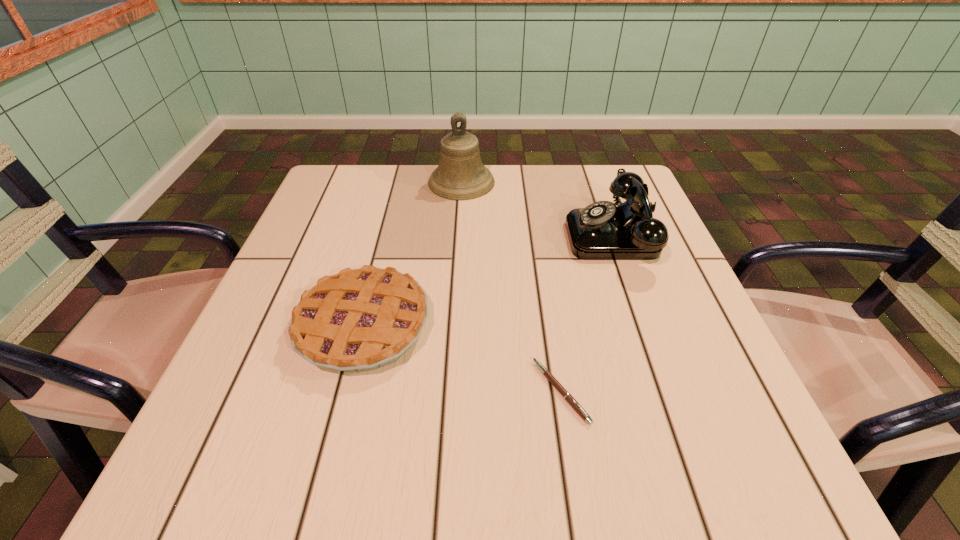
The height and width of the screenshot is (540, 960). What are the coordinates of `vacant space at the far edge` in the screenshot? It's located at (556, 183).

Where is `free space at the left edge of the desktop`? Image resolution: width=960 pixels, height=540 pixels. free space at the left edge of the desktop is located at coordinates (295, 413).

You are a GUI agent. You are given a task and a screenshot of the screen. Output one action in this format:
    pyautogui.click(x=<x>, y=<y>)
    Task: Click on the vacant area at the right edge
    This screenshot has height=540, width=960.
    Given the screenshot: What is the action you would take?
    pyautogui.click(x=677, y=394)

You are a GUI agent. You are given a task and a screenshot of the screen. Output one action in this format:
    pyautogui.click(x=<x>, y=<y>)
    Task: Click on the free space at the far right corner
    
    Given the screenshot: What is the action you would take?
    pyautogui.click(x=594, y=172)

Image resolution: width=960 pixels, height=540 pixels. In the image, there is a desktop. What are the coordinates of `vacant space at the near right corner` in the screenshot? It's located at (762, 482).

This screenshot has height=540, width=960. Identify the location of free point between the second tallest object and the third tallest object. (490, 280).

Locate an element on the screen. free point between the pie and the rightmost object is located at coordinates (490, 280).

The width and height of the screenshot is (960, 540). I want to click on free space between the shortest object and the tallest object, so click(x=511, y=287).

Identify the location of free space between the rightmost object and the bell. (539, 208).

Image resolution: width=960 pixels, height=540 pixels. I want to click on vacant area between the farthest object and the second farthest object, so click(x=539, y=208).